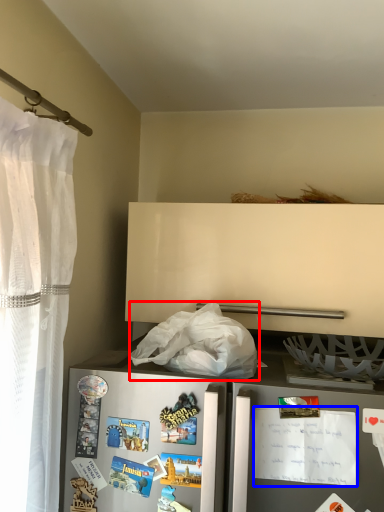
Question: Which object appears farthest to the camera in this image, plastic bag (highlighted by a red box) or postcard (highlighted by a blue box)?

Choices:
 (A) plastic bag
 (B) postcard

Answer: (A)